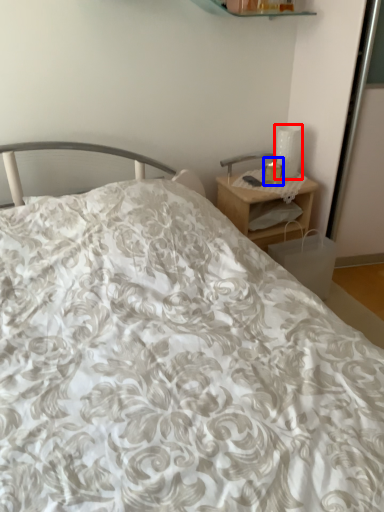
Question: Among these objects, which one is farthest to the camera, table lamp (highlighted by a red box) or candle holder (highlighted by a blue box)?

Choices:
 (A) table lamp
 (B) candle holder

Answer: (A)